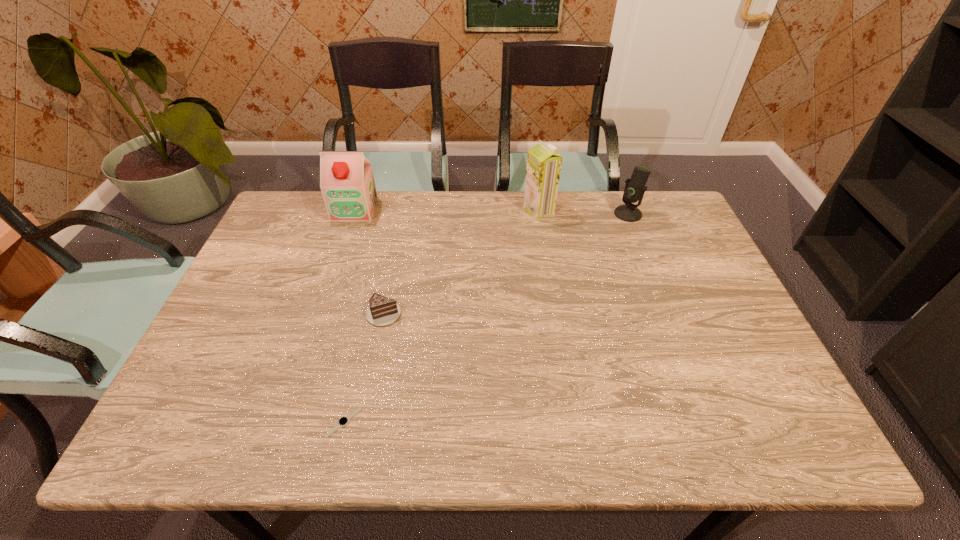
You are a GUI agent. You are given a task and a screenshot of the screen. Output one action in this format:
    pyautogui.click(x=<x>, y=<y>)
    Task: Click on the vacant position in the image that satisfies the following two spatial constraints: 1. with the cap open on the nearest object; 2. on the right side of the leftmost object
    
    Given the screenshot: What is the action you would take?
    pyautogui.click(x=283, y=422)

What are the coordinates of `vacant space that satisfies the following two spatial constraints: 1. on the back side of the right soya milk; 2. on the right side of the watch` in the screenshot? It's located at (393, 210).

Locate an element on the screen. free space that satisfies the following two spatial constraints: 1. on the back side of the nearest object; 2. on the left side of the third shortest object is located at coordinates (392, 214).